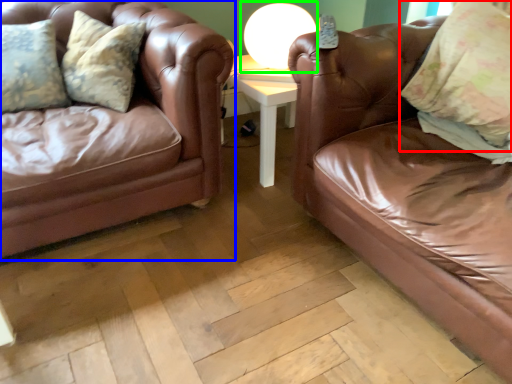
Question: Which is nearer to the pillow (highlighted by a red box)? studio couch (highlighted by a blue box) or table lamp (highlighted by a green box).

Choices:
 (A) studio couch
 (B) table lamp

Answer: (B)